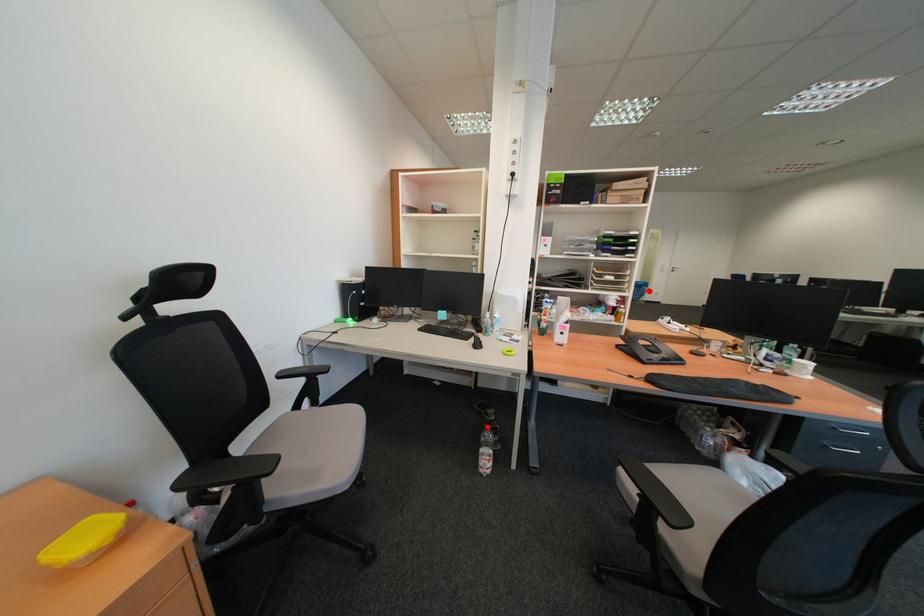
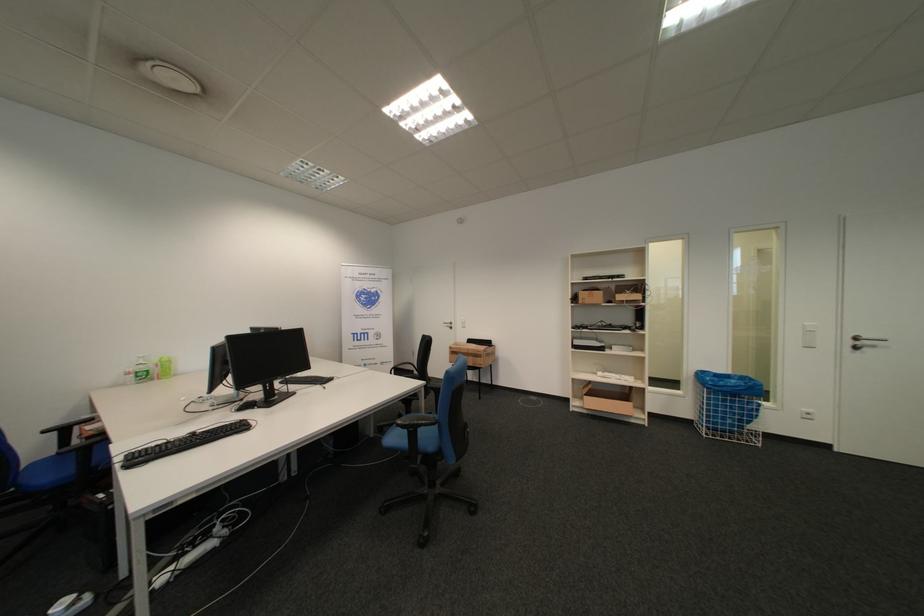
Question: I am providing you with two images of the same scene from different viewpoints. A red point is marked on the first image. Is the red point's position out of view in image 2?

Choices:
 (A) Yes
 (B) No

Answer: (B)